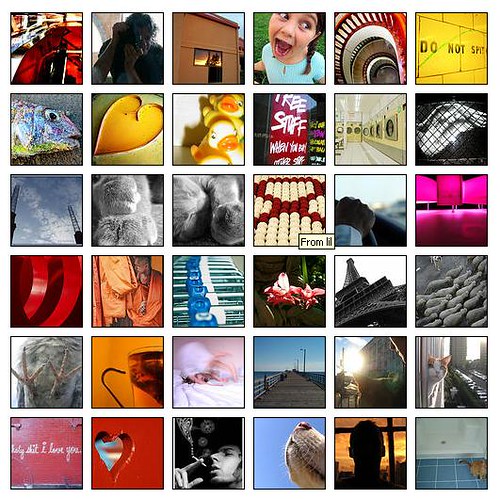
I want to click on washing machines, so click(391, 129), click(379, 129), click(374, 130), click(367, 131), click(356, 126), click(349, 129), click(339, 129).